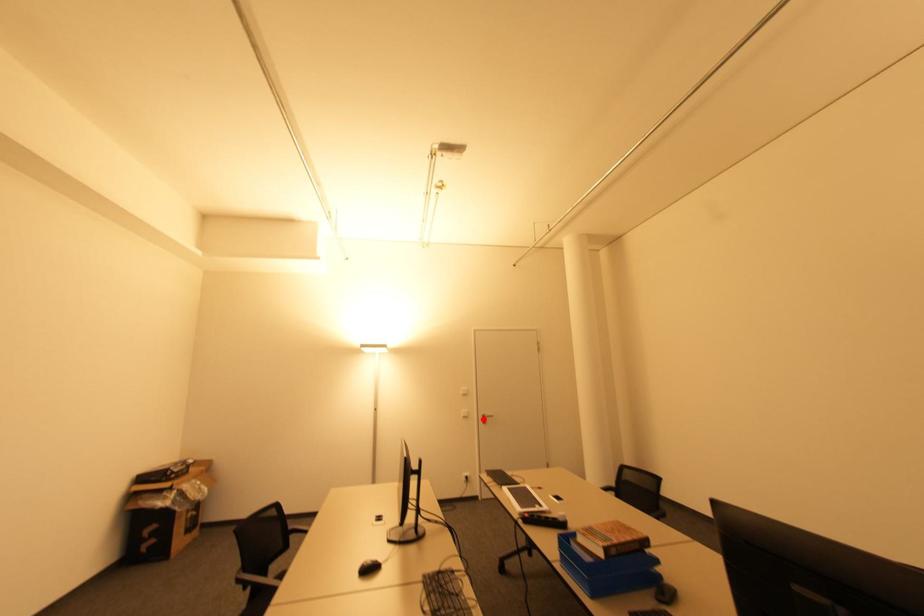
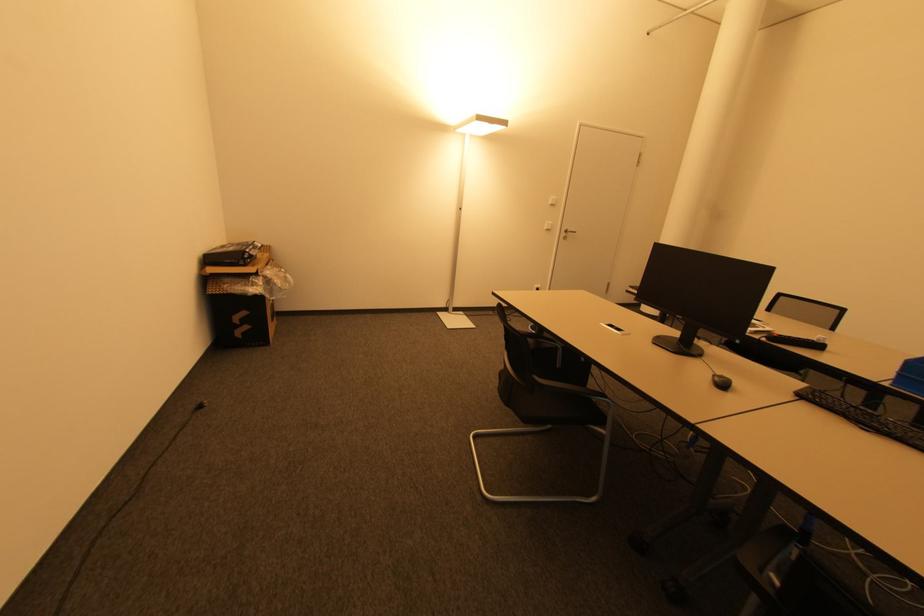
Find the pixel in the second image that matches the highlighted location in the first image.

(565, 235)